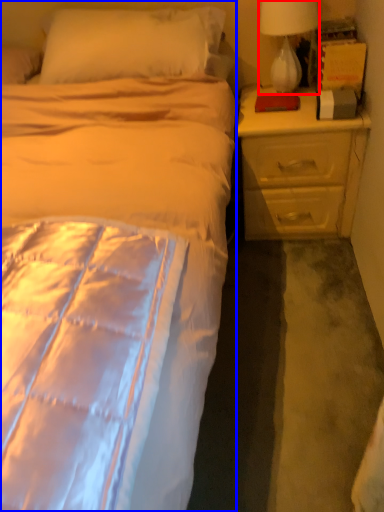
Question: Which object is closer to the camera taking this photo, lamp (highlighted by a red box) or bed (highlighted by a blue box)?

Choices:
 (A) lamp
 (B) bed

Answer: (B)